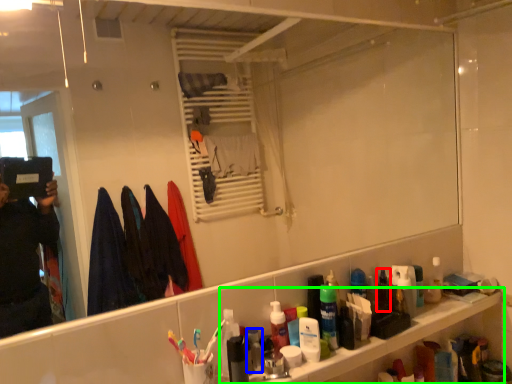
Question: Which object is the closest to the mouthwash (highlighted by a red box)? Choose among these: toiletry (highlighted by a blue box) or cabinet (highlighted by a green box).

Choices:
 (A) toiletry
 (B) cabinet

Answer: (B)